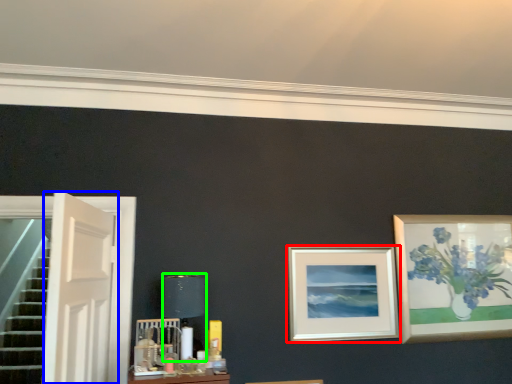
Question: Which object is the farthest from picture frame (highlighted by a red box)? Choose among these: door (highlighted by a blue box) or table lamp (highlighted by a green box).

Choices:
 (A) door
 (B) table lamp

Answer: (A)